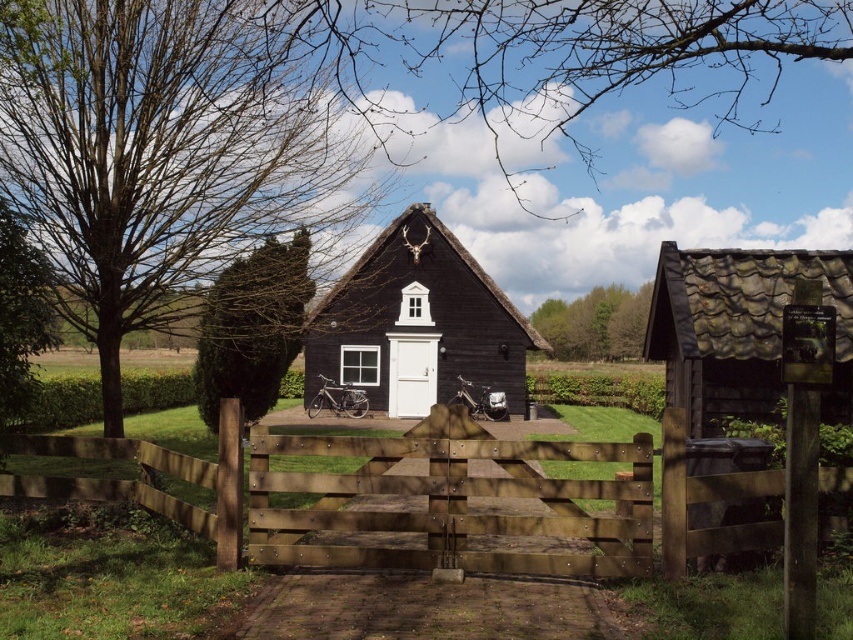
You are a landscape architect designing a garden. You need to place a new statue that requires a spot with more open space. Based on the scene, which object between the rustic brown hut at right and the green leafy trees at center would you choose for the statue placement?

The rustic brown hut at right occupies less space than the green leafy trees at center, so the area around the rustic brown hut at right likely has more open space. Therefore, the statue should be placed near the rustic brown hut at right.

In the scene shown: You are standing at the entrance of the rural scene and see the green leafy tree at center. If you want to reach the tree, how many steps would you need to take, assuming each step covers 3 feet?

The green leafy tree at center is 27.02 feet away from the viewer. Since each step covers 3 feet, you would need approximately 9 steps to reach the tree.